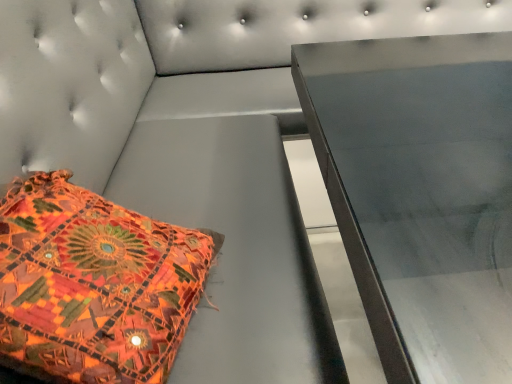
Question: Is textured fabric pillow at lower left in front of or behind metallic table at center in the image?

Choices:
 (A) front
 (B) behind

Answer: (A)

Question: From a real-world perspective, relative to metallic table at center, is textured fabric pillow at lower left vertically above or below?

Choices:
 (A) above
 (B) below

Answer: (A)

Question: Considering the positions of textured fabric pillow at lower left and metallic table at center in the image, is textured fabric pillow at lower left wider or thinner than metallic table at center?

Choices:
 (A) thin
 (B) wide

Answer: (A)

Question: From a real-world perspective, is metallic table at center physically located above or below textured fabric pillow at lower left?

Choices:
 (A) above
 (B) below

Answer: (B)

Question: Looking at their shapes, would you say metallic table at center is wider or thinner than textured fabric pillow at lower left?

Choices:
 (A) thin
 (B) wide

Answer: (B)

Question: Is metallic table at center inside the boundaries of textured fabric pillow at lower left, or outside?

Choices:
 (A) inside
 (B) outside

Answer: (B)

Question: Is metallic table at center in front of or behind textured fabric pillow at lower left in the image?

Choices:
 (A) front
 (B) behind

Answer: (B)